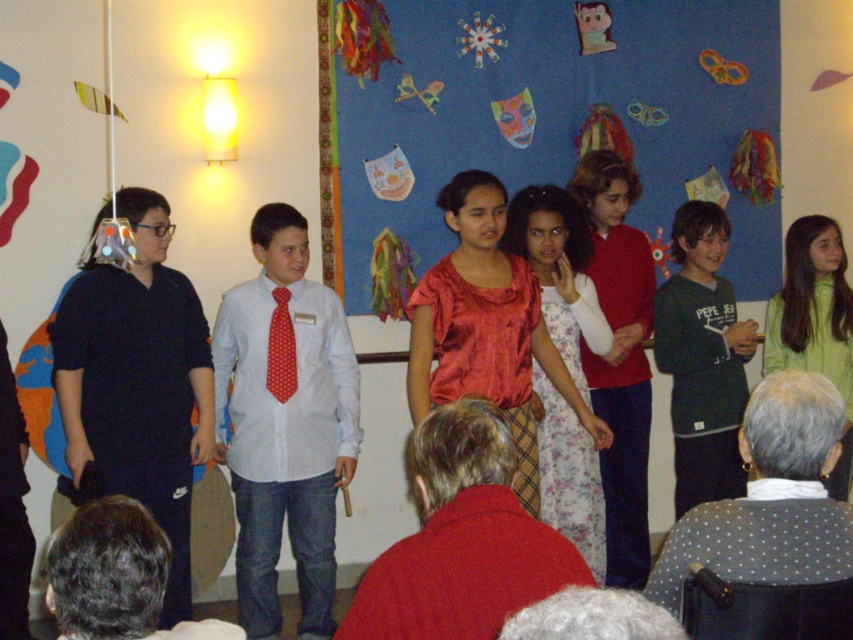
You are a photographer trying to capture a photo of the children on stage. You notice two red items at the center of the scene. Which one is more to the right, the red cotton sweater at center or the red dotted tie at center?

The red cotton sweater at center is more to the right because it is positioned on the right side of the red dotted tie at center.

You are a photographer trying to capture a photo of the children on stage. You notice the red cotton sweater at center and the red dotted tie at center. Which one should you focus on if you want to highlight the lower part of the scene?

The red cotton sweater at center is positioned under the red dotted tie at center, so focusing on the red cotton sweater at center would highlight the lower part of the scene.

You are standing in front of the stage where the children are performing. You want to place a new decoration at a point that is exactly 3 meters away from where you are standing. Is the point at coordinates point (434, 296) within this 3 meter range?

The distance of point (434, 296) from camera is 3.18 meters, so the point is slightly beyond the 3 meter range. You would need to move closer to ensure the decoration is placed within the desired distance.